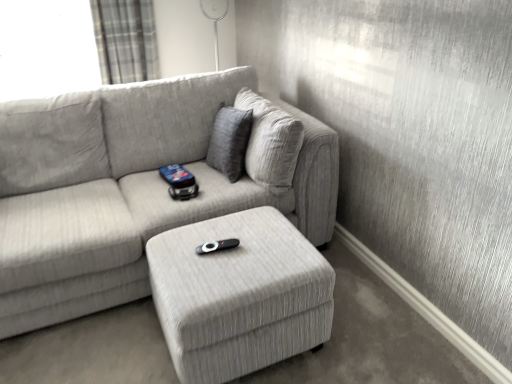
Identify the location of free location above textured gray ottoman at center (from a real-world perspective). (233, 247).